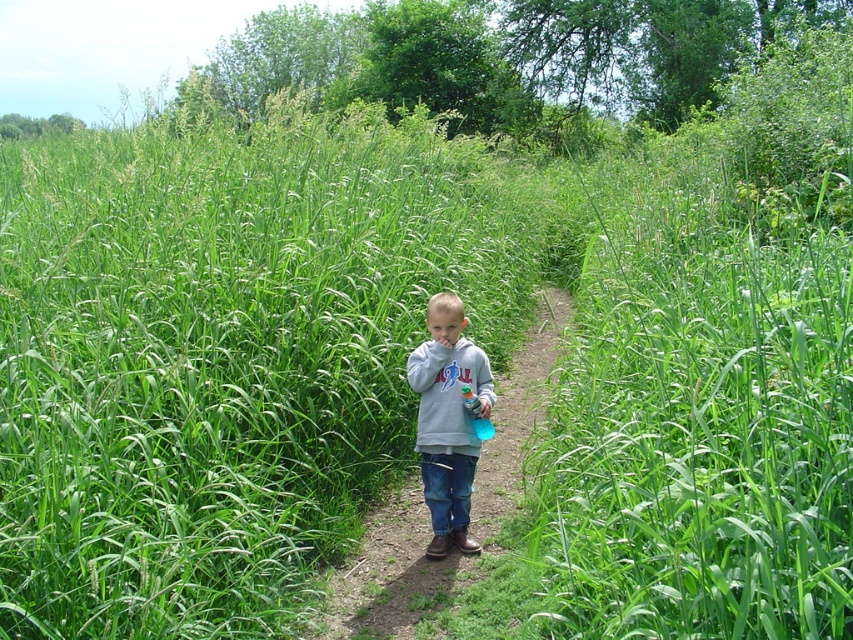
Question: Does gray sweatshirt at center appear over gray fleece sweatshirt at center?

Choices:
 (A) no
 (B) yes

Answer: (A)

Question: Which of the following is the farthest from the observer?

Choices:
 (A) gray sweatshirt at center
 (B) gray fleece sweatshirt at center

Answer: (A)

Question: Is gray sweatshirt at center bigger than gray fleece sweatshirt at center?

Choices:
 (A) yes
 (B) no

Answer: (B)

Question: Is gray sweatshirt at center to the right of gray fleece sweatshirt at center from the viewer's perspective?

Choices:
 (A) no
 (B) yes

Answer: (B)

Question: Which point is farther to the camera?

Choices:
 (A) (491, 480)
 (B) (485, 397)

Answer: (A)